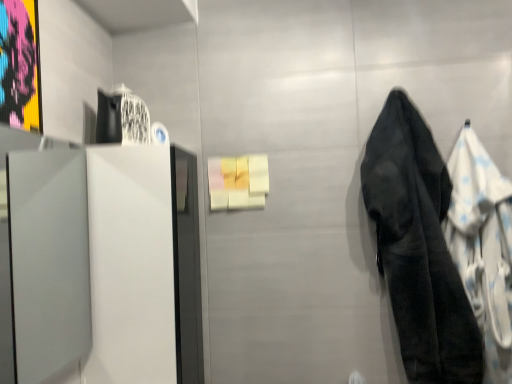
Question: From the image's perspective, is black fabric towel at right above or below black fabric coat at right?

Choices:
 (A) below
 (B) above

Answer: (B)

Question: Is black fabric towel at right spatially inside black fabric coat at right, or outside of it?

Choices:
 (A) outside
 (B) inside

Answer: (A)

Question: In the image, is black fabric towel at right positioned in front of or behind black fabric coat at right?

Choices:
 (A) behind
 (B) front

Answer: (B)

Question: From a real-world perspective, is black fabric coat at right above or below black fabric towel at right?

Choices:
 (A) above
 (B) below

Answer: (B)

Question: From their relative heights in the image, would you say black fabric coat at right is taller or shorter than black fabric towel at right?

Choices:
 (A) tall
 (B) short

Answer: (B)

Question: Is black fabric coat at right bigger or smaller than black fabric towel at right?

Choices:
 (A) small
 (B) big

Answer: (A)

Question: Choose the correct answer: Is black fabric coat at right inside black fabric towel at right or outside it?

Choices:
 (A) outside
 (B) inside

Answer: (A)